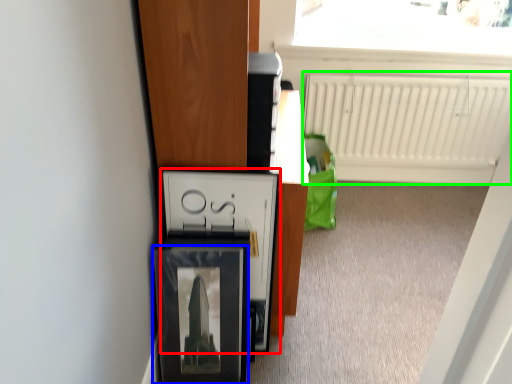
Question: Which object is the closest to the cabinetry (highlighted by a red box)? Choose among these: picture frame (highlighted by a blue box) or radiator (highlighted by a green box).

Choices:
 (A) picture frame
 (B) radiator

Answer: (A)